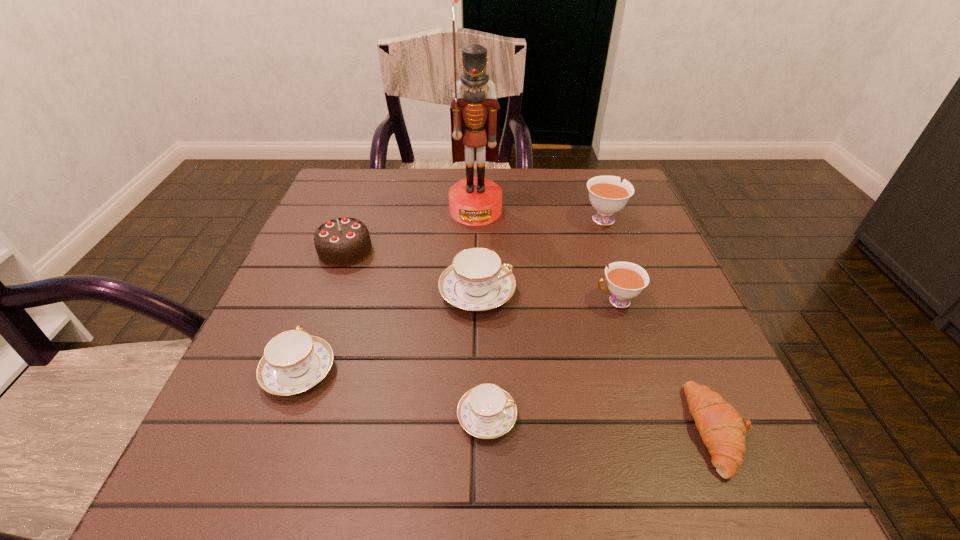
Find the location of a particular element. free space that is in between the red nutcracker and the chocolate cake is located at coordinates (411, 231).

What are the coordinates of `vacant space that's between the chocolate chocolate cake and the nutcracker` in the screenshot? It's located at (411, 231).

Identify the location of free spot between the farthest blue teacup and the chocolate chocolate cake. (411, 272).

Identify the location of empty location between the farthest blue teacup and the leftmost blue teacup. The width and height of the screenshot is (960, 540). (388, 332).

Image resolution: width=960 pixels, height=540 pixels. I want to click on free space between the farther white teacup and the nearer white teacup, so click(610, 259).

The height and width of the screenshot is (540, 960). I want to click on unoccupied position between the farthest blue teacup and the smallest blue teacup, so click(482, 355).

Where is `vacant space that's between the farthest blue teacup and the crescent roll`? The image size is (960, 540). vacant space that's between the farthest blue teacup and the crescent roll is located at coordinates (597, 361).

Locate which object ranks fifth in proximity to the biggest blue teacup. Please provide its 2D coordinates. Your answer should be formatted as a tuple, i.e. [(x, y)], where the tuple contains the x and y coordinates of a point satisfying the conditions above.

[(294, 361)]

Select which object is the second closest to the leftmost blue teacup. Please provide its 2D coordinates. Your answer should be formatted as a tuple, i.e. [(x, y)], where the tuple contains the x and y coordinates of a point satisfying the conditions above.

[(340, 242)]

Identify which teacup is the closest to the bigger white teacup. Please provide its 2D coordinates. Your answer should be formatted as a tuple, i.e. [(x, y)], where the tuple contains the x and y coordinates of a point satisfying the conditions above.

[(625, 280)]